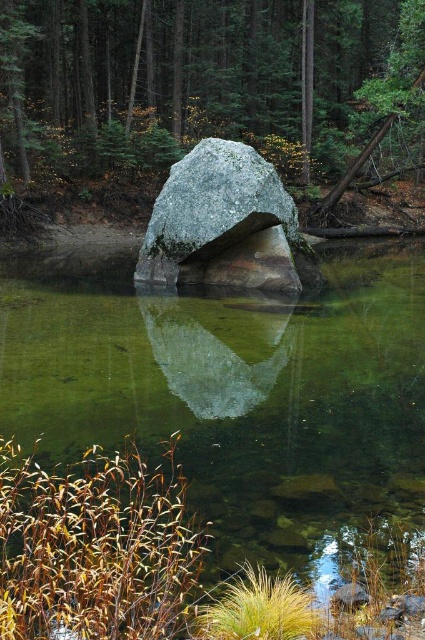
Question: Which point appears closest to the camera in this image?

Choices:
 (A) (384, 531)
 (B) (204, 161)

Answer: (A)

Question: Which object appears farthest from the camera in this image?

Choices:
 (A) smooth gray rock at center
 (B) clear glass water at center
 (C) gray granite boulder at center

Answer: (A)

Question: Observing the image, what is the correct spatial positioning of clear glass water at center in reference to gray granite boulder at center?

Choices:
 (A) right
 (B) left

Answer: (B)

Question: Estimate the real-world distances between objects in this image. Which object is closer to the clear glass water at center?

Choices:
 (A) gray granite boulder at center
 (B) smooth gray rock at center

Answer: (A)

Question: Does smooth gray rock at center have a larger size compared to gray granite boulder at center?

Choices:
 (A) yes
 (B) no

Answer: (A)

Question: Does clear glass water at center come in front of smooth gray rock at center?

Choices:
 (A) yes
 (B) no

Answer: (A)